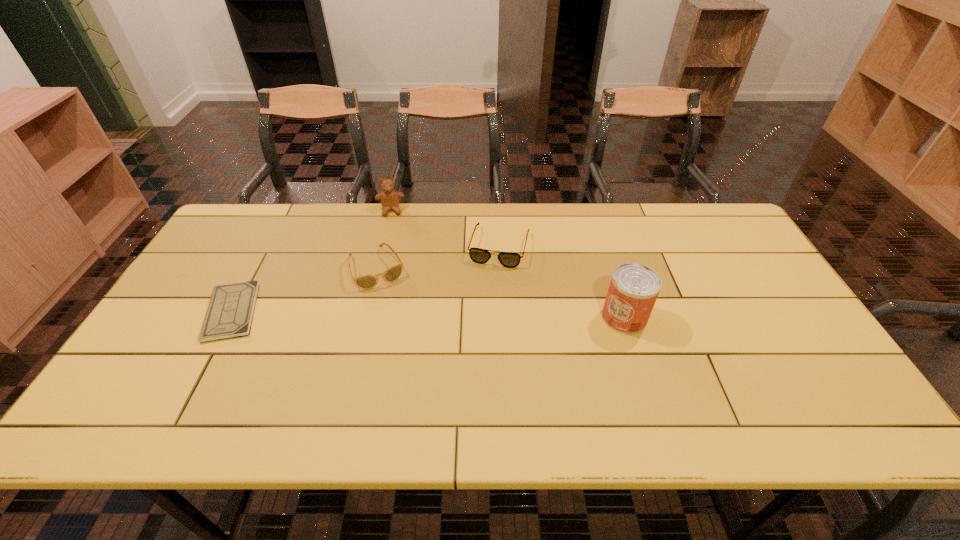
Identify the location of vacant space that satisfies the following two spatial constraints: 1. on the back side of the shortest object; 2. on the left side of the spectacles. (x=267, y=246).

You are a GUI agent. You are given a task and a screenshot of the screen. Output one action in this format:
    pyautogui.click(x=<x>, y=<y>)
    Task: Click on the blank space that satisfies the following two spatial constraints: 1. on the front side of the second tallest object; 2. on the left side of the tallest object
    Image resolution: width=960 pixels, height=540 pixels.
    Given the screenshot: What is the action you would take?
    pyautogui.click(x=364, y=317)

Identify the location of free space that satisfies the following two spatial constraints: 1. on the back side of the shortest object; 2. on the left side of the sunglasses. The image size is (960, 540). (255, 268).

This screenshot has height=540, width=960. I want to click on vacant area in the image that satisfies the following two spatial constraints: 1. on the front side of the tallest object; 2. on the left side of the checkbook, so click(x=229, y=317).

You are a GUI agent. You are given a task and a screenshot of the screen. Output one action in this format:
    pyautogui.click(x=<x>, y=<y>)
    Task: Click on the free space that satisfies the following two spatial constraints: 1. on the back side of the leftmost object; 2. on the left side of the sunglasses
    
    Given the screenshot: What is the action you would take?
    (255, 268)